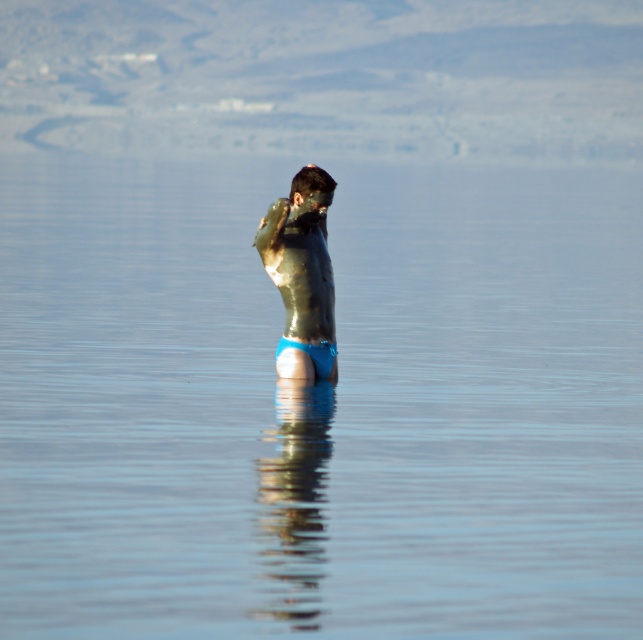
You are a photographer trying to capture the shiny metallic man at center and the blue fabric at center. Based on their positions, which object should you adjust your camera focus to first if you want to take a photo that includes both in the frame?

The shiny metallic man at center is positioned on the left side of blue fabric at center, so you should focus on the shiny metallic man at center first to ensure both objects are in frame.